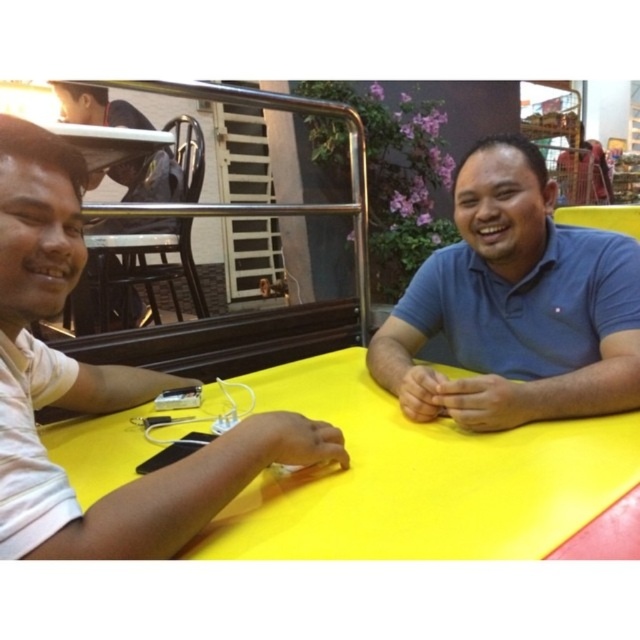
Question: Does blue cotton shirt at center have a smaller size compared to white matte shirt at left?

Choices:
 (A) yes
 (B) no

Answer: (A)

Question: Does blue cotton shirt at center have a greater width compared to matte black shirt at upper left?

Choices:
 (A) yes
 (B) no

Answer: (B)

Question: Which point is farther to the camera?

Choices:
 (A) blue cotton shirt at center
 (B) yellow matte table at center

Answer: (A)

Question: Is yellow matte table at center smaller than white matte shirt at left?

Choices:
 (A) no
 (B) yes

Answer: (B)

Question: Which object appears closest to the camera in this image?

Choices:
 (A) white matte shirt at left
 (B) yellow matte table at center

Answer: (A)

Question: Which object is positioned farthest from the blue cotton shirt at center?

Choices:
 (A) matte black shirt at upper left
 (B) yellow matte table at center
 (C) white matte shirt at left

Answer: (A)